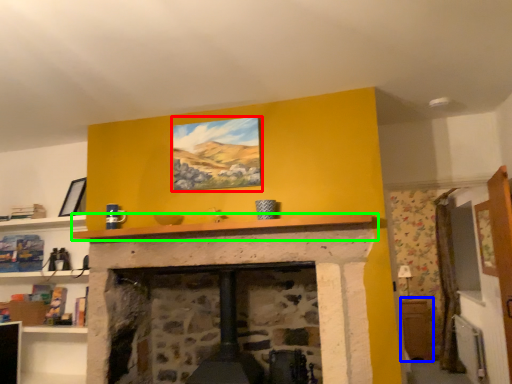
Question: Considering the real-world distances, which object is closest to picture frame (highlighted by a red box)? table (highlighted by a blue box) or mantle (highlighted by a green box).

Choices:
 (A) table
 (B) mantle

Answer: (B)